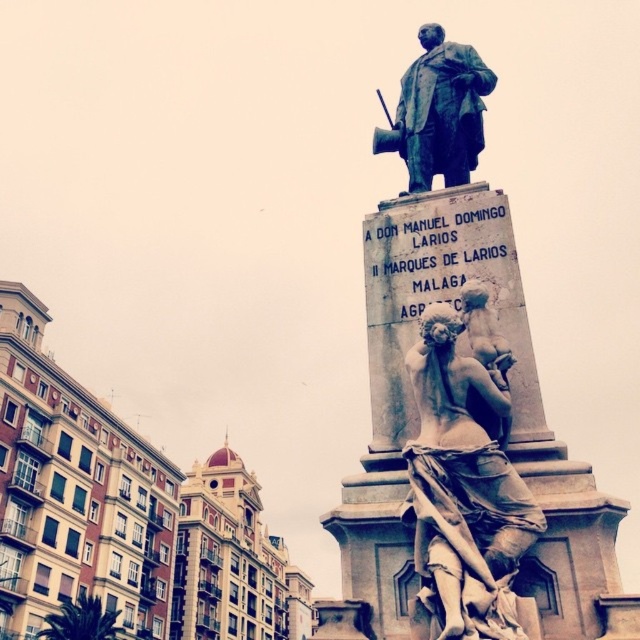
You are standing in the public square and want to take a photo of the bronze statue at center. If you are positioned at point A, which is at coordinates 0.333, 0.333, in which direction should you move to get a better view of the statue?

The bronze statue at center is located at point (x=417, y=426). Since you are at point (x=212, y=212), you should move northeast to get a better view of the statue.